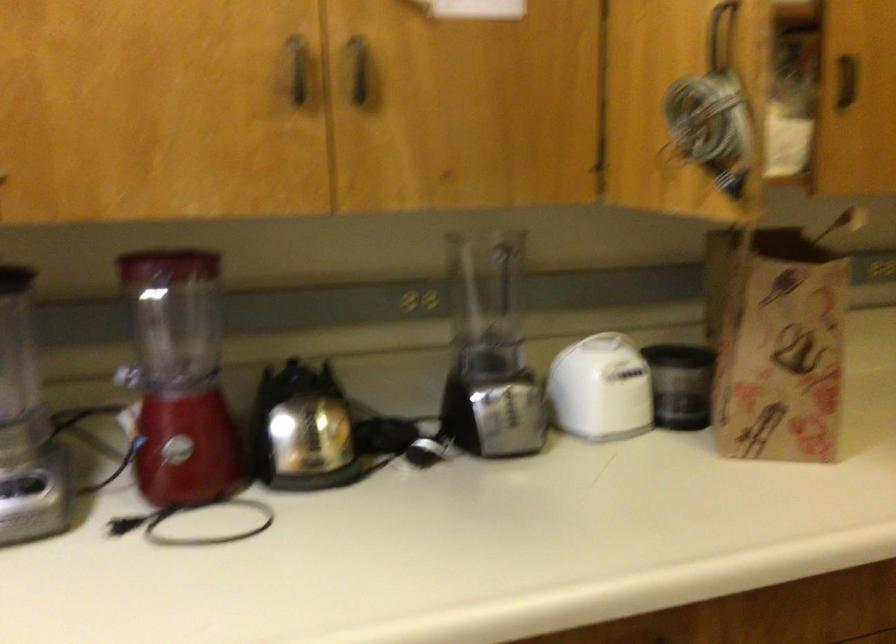
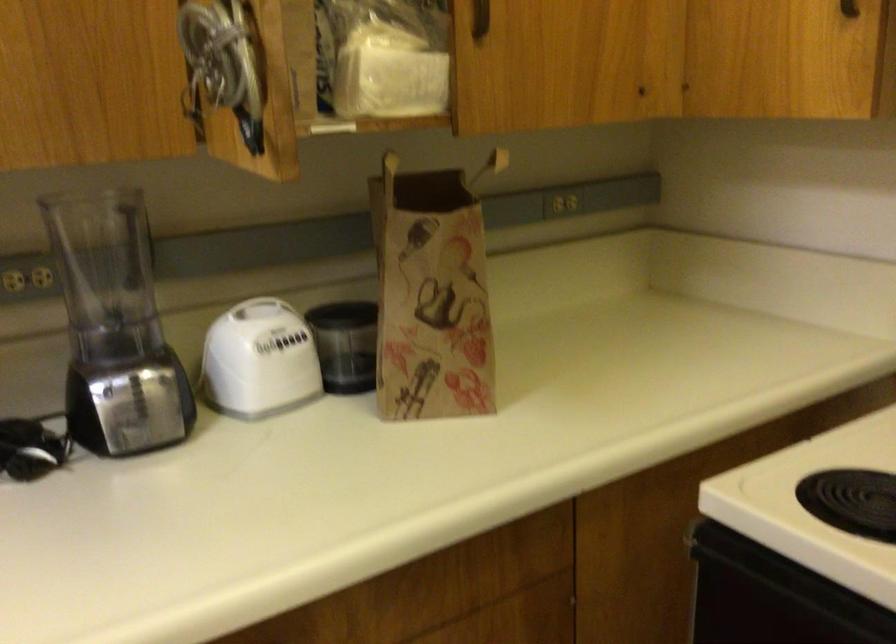
Where in the second image is the point corresponding to (x=493, y=343) from the first image?

(115, 327)